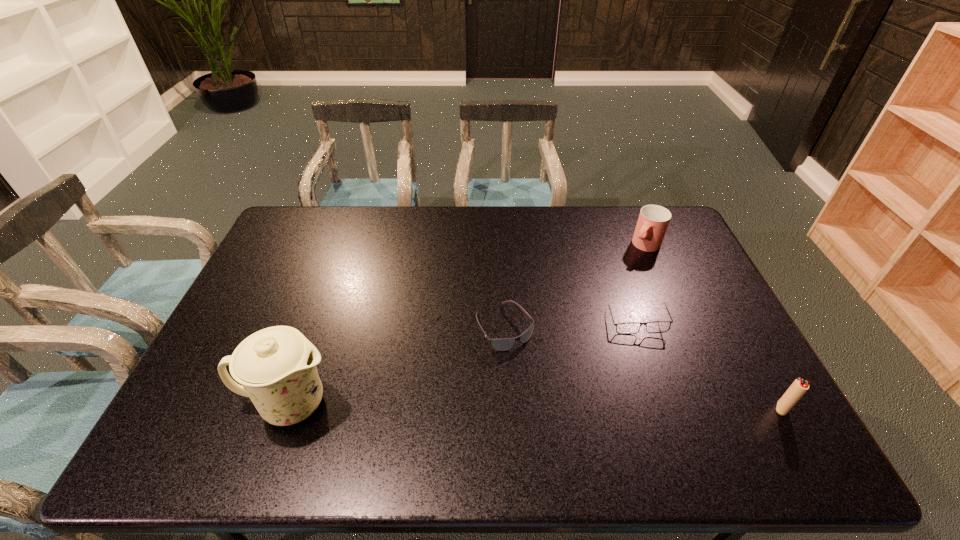
The image size is (960, 540). In the image, there is a desktop. In order to click on vacant space at the near right corner in this screenshot , I will do `click(747, 415)`.

This screenshot has width=960, height=540. In order to click on free space between the leftmost object and the spectacles in this screenshot , I will do `click(463, 363)`.

Find the location of `vacant area between the cup and the spectacles`. vacant area between the cup and the spectacles is located at coordinates (641, 284).

The image size is (960, 540). What are the coordinates of `free space between the spectacles and the chinaware` in the screenshot? It's located at tap(463, 363).

You are a GUI agent. You are given a task and a screenshot of the screen. Output one action in this format:
    pyautogui.click(x=<x>, y=<y>)
    Task: Click on the free space between the fourth object from right to left and the farthest object
    This screenshot has height=540, width=960.
    Given the screenshot: What is the action you would take?
    pyautogui.click(x=575, y=286)

Identify the location of free space between the tallest object and the igniter. (536, 406).

I want to click on vacant area that lies between the fourth object from right to left and the cup, so click(x=575, y=286).

Identify the location of vacant point located between the tallest object and the farthest object. [468, 325].

I want to click on vacant space that is in between the spectacles and the cup, so click(x=641, y=284).

Where is `vacant area between the rightmost object and the spectacles`? This screenshot has width=960, height=540. vacant area between the rightmost object and the spectacles is located at coordinates (709, 366).